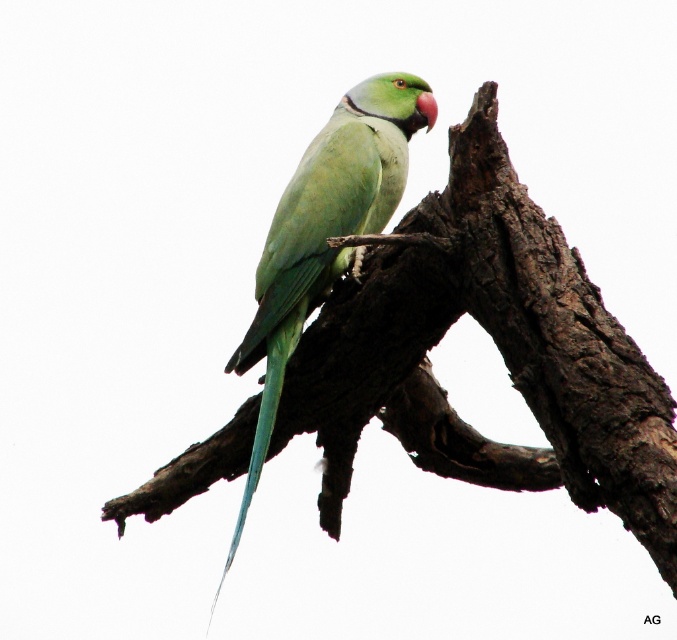
You are standing in front of the parrot and want to touch the two points on the image. Which point, point [533,332] or point [265,321], is closer to you?

Point [533,332] is closer to the viewer than point [265,321].

Consider the image. You are a photographer aiming to capture the green matte parrot at center and the green matte tree branch at center in your shot. Which object should you adjust your focus on first if you want to ensure the parrot is in sharp focus before the branch?

You should focus on the green matte parrot at center first because the green matte tree branch at center is positioned on the right side of it, meaning the parrot is closer to the camera. Adjusting focus starting from the closer object ensures sharpness before moving to the branch further away.

You are an ornithologist observing a parrot in its natural habitat. You notice the green matte parrot at center and the green matte tree branch at center. Based on their positions, which object is closer to the ground?

The green matte tree branch at center is located below the green matte parrot at center, so the tree branch is closer to the ground.